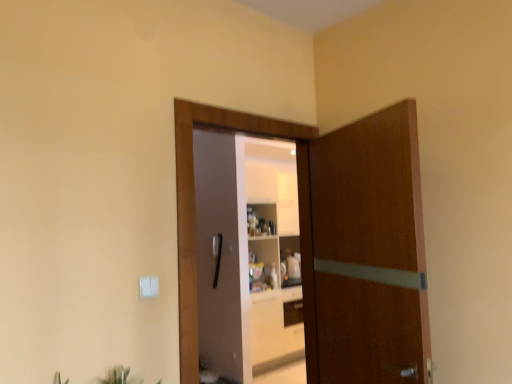
Question: From the image's perspective, is green leafy plant at lower center above or below brown wooden door at center, which is the 1th door from right to left?

Choices:
 (A) below
 (B) above

Answer: (A)

Question: Is green leafy plant at lower center to the left or to the right of brown wooden door at center, the second door when ordered from left to right, in the image?

Choices:
 (A) left
 (B) right

Answer: (A)

Question: Considering the real-world distances, which object is closest to the green leafy plant at lower center?

Choices:
 (A) brown wooden door at center, which is the 1th door from right to left
 (B) wooden door at center, the second door when ordered from right to left

Answer: (B)

Question: Considering the real-world distances, which object is farthest from the brown wooden door at center, which is the 1th door from right to left?

Choices:
 (A) wooden door at center, the second door when ordered from right to left
 (B) green leafy plant at lower center

Answer: (B)